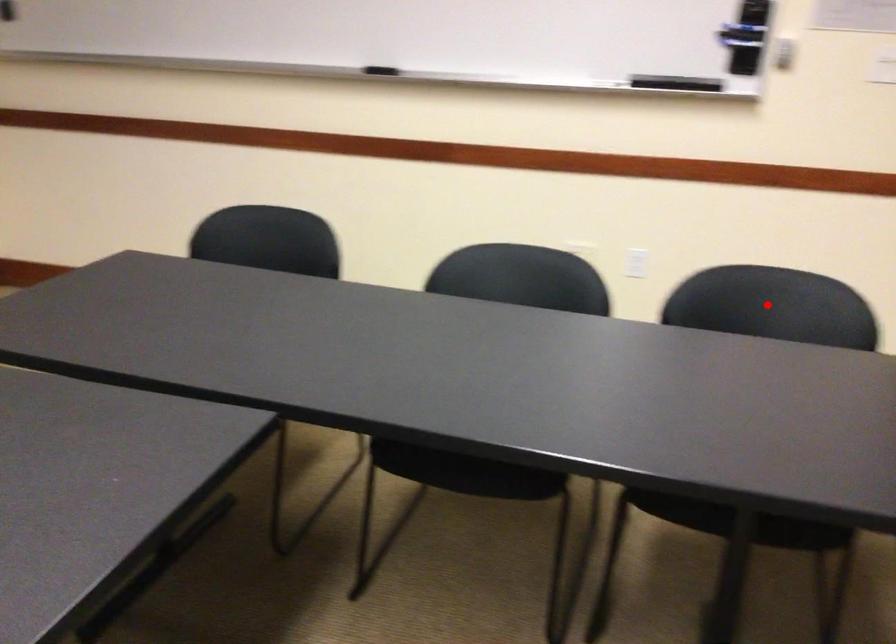
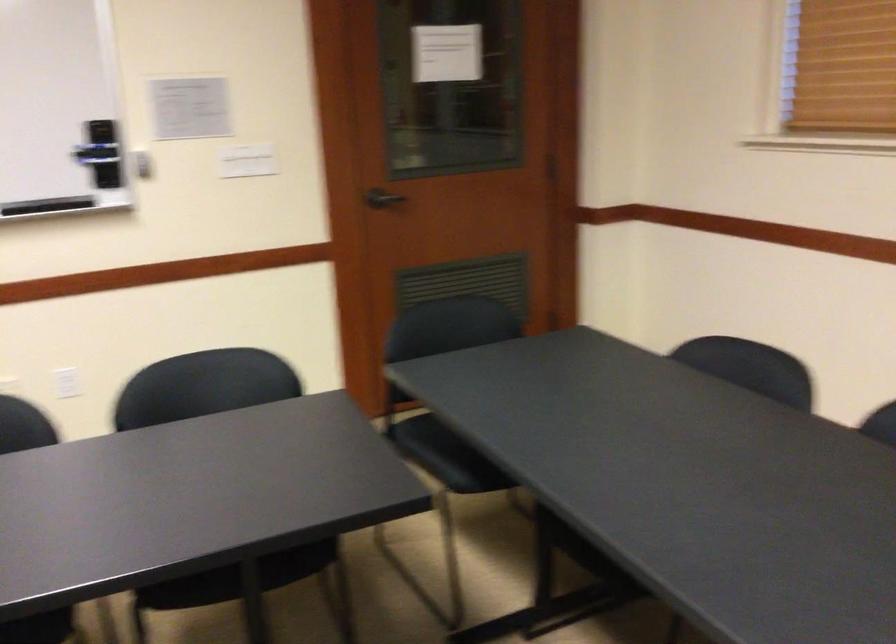
Locate, in the second image, the point that corresponds to the highlighted location in the first image.

(218, 381)